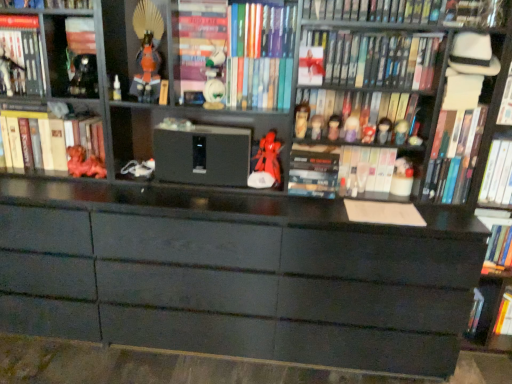
Question: Is metallic silver figurine at upper left, the 1th toy viewed from the left, positioned beyond the bounds of matte plastic figurines at center, the eighth book from the right?

Choices:
 (A) no
 (B) yes

Answer: (B)

Question: Is the depth of metallic silver figurine at upper left, the 1th toy viewed from the left, less than that of matte plastic figurines at center, the eighth book from the right?

Choices:
 (A) no
 (B) yes

Answer: (B)

Question: Is metallic silver figurine at upper left, which is the sixteenth toy from right to left, smaller than matte plastic figurines at center, the eighth book from the right?

Choices:
 (A) no
 (B) yes

Answer: (B)

Question: Considering the relative sizes of metallic silver figurine at upper left, the 1th toy viewed from the left, and matte plastic figurines at center, the eighth book from the right, in the image provided, is metallic silver figurine at upper left, the 1th toy viewed from the left, wider than matte plastic figurines at center, the eighth book from the right,?

Choices:
 (A) yes
 (B) no

Answer: (B)

Question: Does metallic silver figurine at upper left, which is the sixteenth toy from right to left, appear on the left side of matte plastic figurines at center, the sixth book when ordered from left to right?

Choices:
 (A) no
 (B) yes

Answer: (B)

Question: Is white glossy book at center, which appears as the fifth book when viewed from the right, wider or thinner than multicolored hardcover books at center, the 5th book viewed from the left?

Choices:
 (A) thin
 (B) wide

Answer: (B)

Question: From the image's perspective, relative to multicolored hardcover books at center, acting as the ninth book starting from the right, is white glossy book at center, which is the 9th book from left to right, above or below?

Choices:
 (A) above
 (B) below

Answer: (B)

Question: From a real-world perspective, relative to multicolored hardcover books at center, acting as the ninth book starting from the right, is white glossy book at center, which is the 9th book from left to right, vertically above or below?

Choices:
 (A) above
 (B) below

Answer: (B)

Question: Considering the positions of point (342, 172) and point (290, 62), is point (342, 172) closer or farther from the camera than point (290, 62)?

Choices:
 (A) farther
 (B) closer

Answer: (A)

Question: From a real-world perspective, is hardcover book at center positioned above or below hardcover book at right, arranged as the 13th book when viewed from the left?

Choices:
 (A) above
 (B) below

Answer: (A)

Question: Is hardcover book at center to the left or to the right of hardcover book at right, arranged as the 13th book when viewed from the left, in the image?

Choices:
 (A) left
 (B) right

Answer: (A)

Question: Looking at their shapes, would you say hardcover book at center is wider or thinner than hardcover book at right, the 1th book viewed from the right?

Choices:
 (A) wide
 (B) thin

Answer: (A)

Question: Is hardcover book at center spatially inside hardcover book at right, arranged as the 13th book when viewed from the left, or outside of it?

Choices:
 (A) outside
 (B) inside

Answer: (A)

Question: In terms of height, does matte black figurine at center, positioned as the 4th toy in right-to-left order, look taller or shorter compared to hardcover book at center?

Choices:
 (A) tall
 (B) short

Answer: (B)

Question: Considering the positions of matte black figurine at center, which is the thirteenth toy in left-to-right order, and hardcover book at center in the image, is matte black figurine at center, which is the thirteenth toy in left-to-right order, wider or thinner than hardcover book at center?

Choices:
 (A) thin
 (B) wide

Answer: (A)